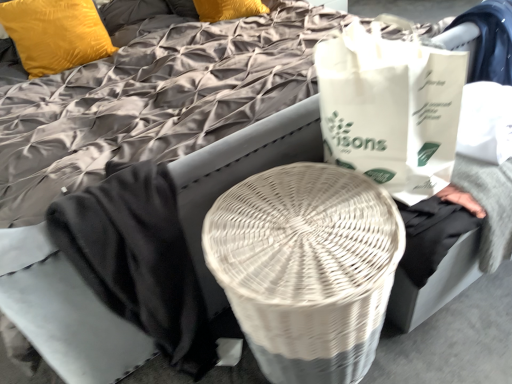
Question: Should I look upward or downward to see velvet yellow pillow at upper left?

Choices:
 (A) up
 (B) down

Answer: (A)

Question: Should I look upward or downward to see white wicker basket at center?

Choices:
 (A) down
 (B) up

Answer: (A)

Question: Can you confirm if white wicker basket at center is bigger than velvet yellow pillow at upper left?

Choices:
 (A) yes
 (B) no

Answer: (A)

Question: Is white wicker basket at center next to velvet yellow pillow at upper left?

Choices:
 (A) no
 (B) yes

Answer: (A)

Question: From a real-world perspective, is white wicker basket at center positioned over velvet yellow pillow at upper left based on gravity?

Choices:
 (A) no
 (B) yes

Answer: (A)

Question: Can you confirm if white wicker basket at center is smaller than velvet yellow pillow at upper left?

Choices:
 (A) no
 (B) yes

Answer: (A)

Question: Is the depth of white wicker basket at center less than that of velvet yellow pillow at upper left?

Choices:
 (A) no
 (B) yes

Answer: (B)

Question: Is white wicker basket at center looking in the opposite direction of velvet yellow pillow at upper left?

Choices:
 (A) no
 (B) yes

Answer: (B)

Question: From the image's perspective, is velvet yellow pillow at upper left below white paper grocery bag at right?

Choices:
 (A) yes
 (B) no

Answer: (B)

Question: Is velvet yellow pillow at upper left shorter than white paper grocery bag at right?

Choices:
 (A) yes
 (B) no

Answer: (A)

Question: Does velvet yellow pillow at upper left have a greater width compared to white paper grocery bag at right?

Choices:
 (A) no
 (B) yes

Answer: (A)

Question: From a real-world perspective, is velvet yellow pillow at upper left beneath white paper grocery bag at right?

Choices:
 (A) yes
 (B) no

Answer: (A)

Question: Is velvet yellow pillow at upper left closer to the viewer compared to white paper grocery bag at right?

Choices:
 (A) no
 (B) yes

Answer: (A)

Question: Would you consider velvet yellow pillow at upper left to be distant from white paper grocery bag at right?

Choices:
 (A) no
 (B) yes

Answer: (B)

Question: Does white wicker basket at center appear on the left side of white paper grocery bag at right?

Choices:
 (A) no
 (B) yes

Answer: (B)